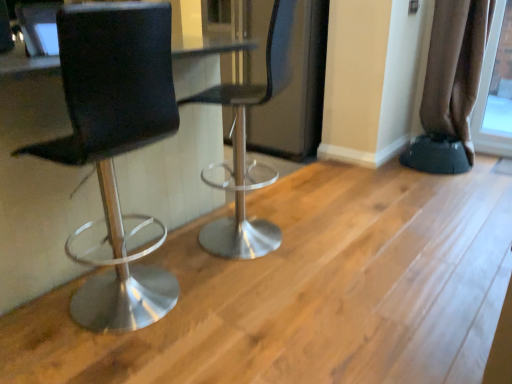
Question: Considering the relative sizes of metallic silver stool at center, which is the first chair from right to left, and black rubber step stool at lower right in the image provided, is metallic silver stool at center, which is the first chair from right to left, taller than black rubber step stool at lower right?

Choices:
 (A) no
 (B) yes

Answer: (B)

Question: Considering the relative sizes of metallic silver stool at center, the 2th chair from the left, and black rubber step stool at lower right in the image provided, is metallic silver stool at center, the 2th chair from the left, shorter than black rubber step stool at lower right?

Choices:
 (A) yes
 (B) no

Answer: (B)

Question: Could you tell me if metallic silver stool at center, which is the first chair from right to left, is turned towards black rubber step stool at lower right?

Choices:
 (A) no
 (B) yes

Answer: (A)

Question: From the image's perspective, is metallic silver stool at center, which is the first chair from right to left, on black rubber step stool at lower right?

Choices:
 (A) yes
 (B) no

Answer: (B)

Question: Is metallic silver stool at center, the 2th chair from the left, positioned behind black rubber step stool at lower right?

Choices:
 (A) yes
 (B) no

Answer: (B)

Question: Is metallic silver stool at center, the 2th chair from the left, completely or partially outside of black rubber step stool at lower right?

Choices:
 (A) yes
 (B) no

Answer: (A)

Question: From a real-world perspective, is matte black stool at left, marked as the second chair in a right-to-left arrangement, positioned over transparent glass screen door at center based on gravity?

Choices:
 (A) no
 (B) yes

Answer: (A)

Question: From the image's perspective, is matte black stool at left, marked as the second chair in a right-to-left arrangement, under transparent glass screen door at center?

Choices:
 (A) yes
 (B) no

Answer: (A)

Question: Could you tell me if matte black stool at left, marked as the second chair in a right-to-left arrangement, is facing transparent glass screen door at center?

Choices:
 (A) yes
 (B) no

Answer: (B)

Question: Does matte black stool at left, which ranks as the 1th chair in left-to-right order, have a larger size compared to transparent glass screen door at center?

Choices:
 (A) no
 (B) yes

Answer: (A)

Question: Does matte black stool at left, which ranks as the 1th chair in left-to-right order, contain transparent glass screen door at center?

Choices:
 (A) yes
 (B) no

Answer: (B)

Question: Can you confirm if matte black stool at left, which ranks as the 1th chair in left-to-right order, is positioned to the left of transparent glass screen door at center?

Choices:
 (A) no
 (B) yes

Answer: (B)

Question: Can you confirm if transparent glass screen door at center is positioned to the right of metallic silver stool at center, which is the first chair from right to left?

Choices:
 (A) yes
 (B) no

Answer: (A)